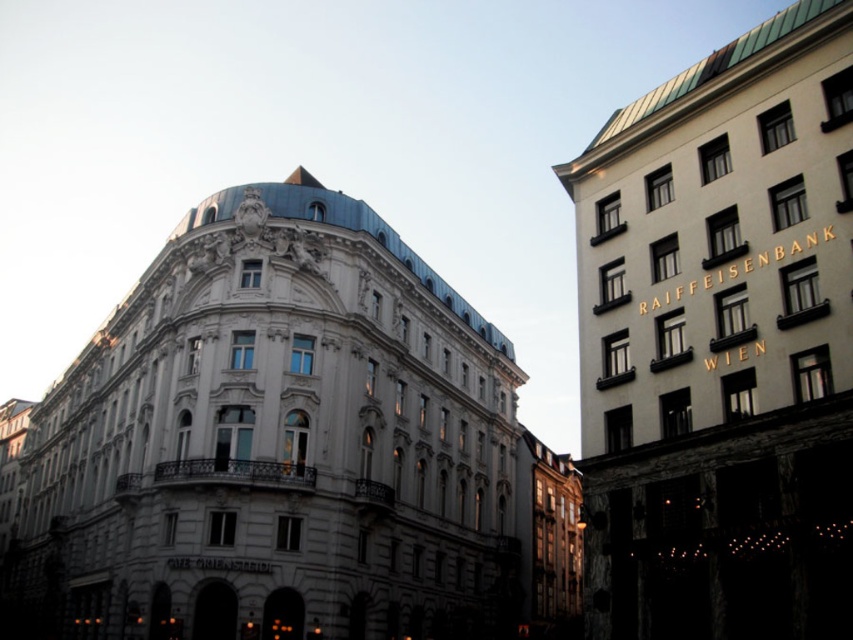
You are an architect evaluating the spatial layout of the buildings in the image. Which building has a greater width between the white stone building at upper right and the matte white building at center?

The white stone building at upper right has a greater width than the matte white building at center according to the description.

You are an architect analyzing the spatial layout of the buildings in the image. Which building has a greater width between the white stone building at center and the white stone building at upper right?

The white stone building at center has a greater width than the white stone building at upper right according to the description.

You are a tourist in Vienna and want to take a photo of both the white stone building at upper right and the matte white building at center. Which building should you position yourself to the left of to include both in your shot?

You should position yourself to the left of the matte white building at center. Since the white stone building at upper right is to the right of the matte white building at center, standing to the left of the matte white building at center will allow you to capture both buildings in your photo.